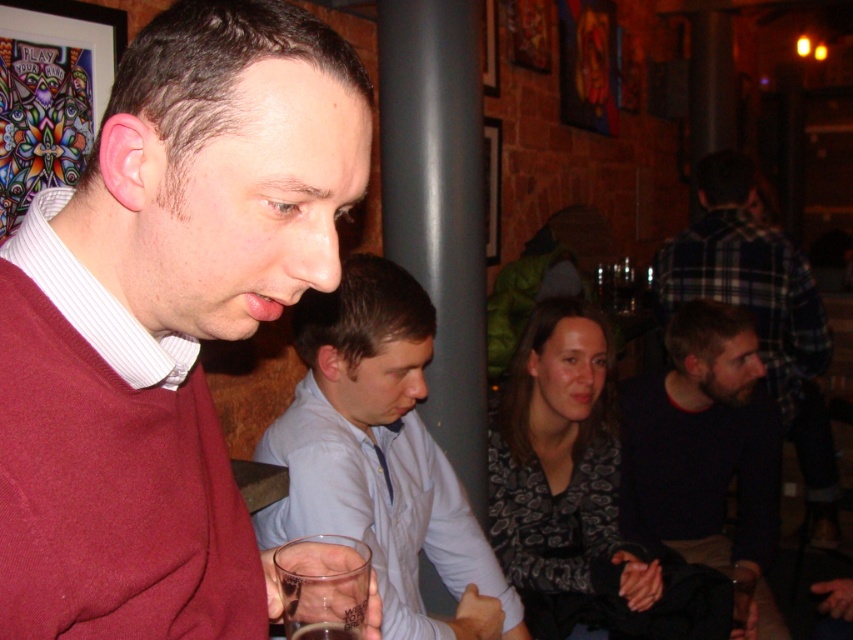
Question: Does maroon sweater at center appear over dark blue sweater at center?

Choices:
 (A) yes
 (B) no

Answer: (A)

Question: Does maroon sweater at center appear under transparent plastic cup at lower center?

Choices:
 (A) yes
 (B) no

Answer: (B)

Question: Among these objects, which one is nearest to the camera?

Choices:
 (A) translucent glass at lower center
 (B) white shirt at center
 (C) transparent plastic cup at lower center

Answer: (C)

Question: Which of the following is the closest to the observer?

Choices:
 (A) [759, 237]
 (B) [80, 416]
 (C) [281, 582]

Answer: (B)

Question: Which object is closer to the camera taking this photo?

Choices:
 (A) white shirt at center
 (B) dark blue sweater at center
 (C) translucent glass at lower center

Answer: (C)

Question: Observing the image, what is the correct spatial positioning of dark blue sweater at right in reference to transparent plastic cup at lower center?

Choices:
 (A) right
 (B) left

Answer: (A)